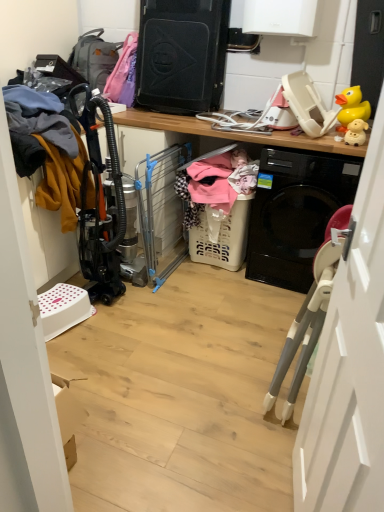
Question: From the image's perspective, relative to yellow rubber toy at upper right, the second toy positioned from the top, is yellow rubber duck at upper right, arranged as the first toy when viewed from the back, above or below?

Choices:
 (A) above
 (B) below

Answer: (A)

Question: Is point (365, 109) positioned closer to the camera than point (364, 134)?

Choices:
 (A) farther
 (B) closer

Answer: (A)

Question: Which object is the farthest from the soft pink fabric at center, which appears as the 2th clothing when viewed from the left?

Choices:
 (A) white plastic laundry basket at center
 (B) matte gray backpack at upper left
 (C) white plastic laundry basket at center
 (D) yellow fleece jacket at left, acting as the 2th clothing starting from the right
 (E) yellow rubber duck at upper right, arranged as the first toy when viewed from the back

Answer: (B)

Question: Estimate the real-world distances between objects in this image. Which object is farther from the white plastic door at right?

Choices:
 (A) yellow rubber duck at upper right, the second toy from the bottom
 (B) yellow rubber toy at upper right, the second toy positioned from the top
 (C) white plastic laundry basket at center
 (D) soft pink fabric at center, which appears as the 2th clothing when viewed from the left
 (E) yellow fleece jacket at left, acting as the 2th clothing starting from the right

Answer: (E)